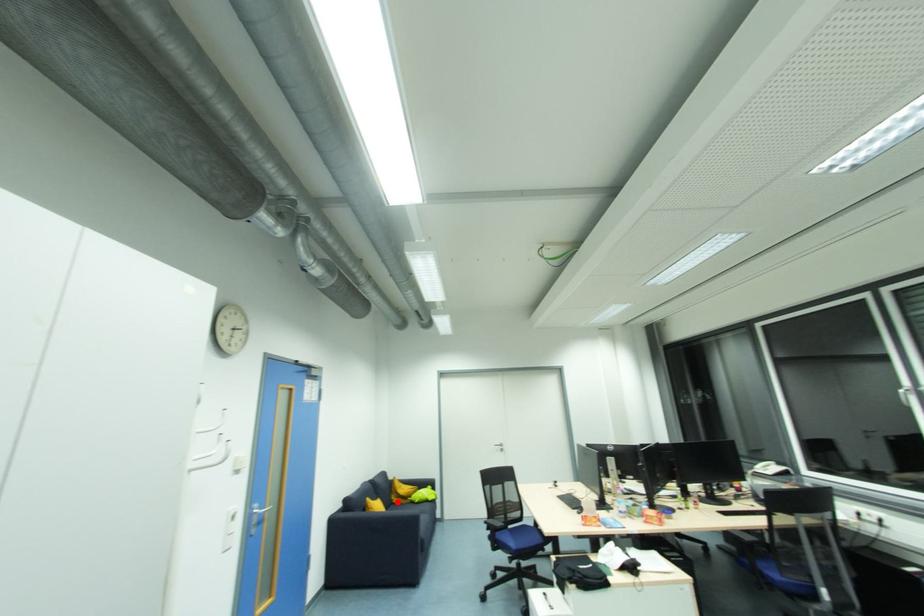
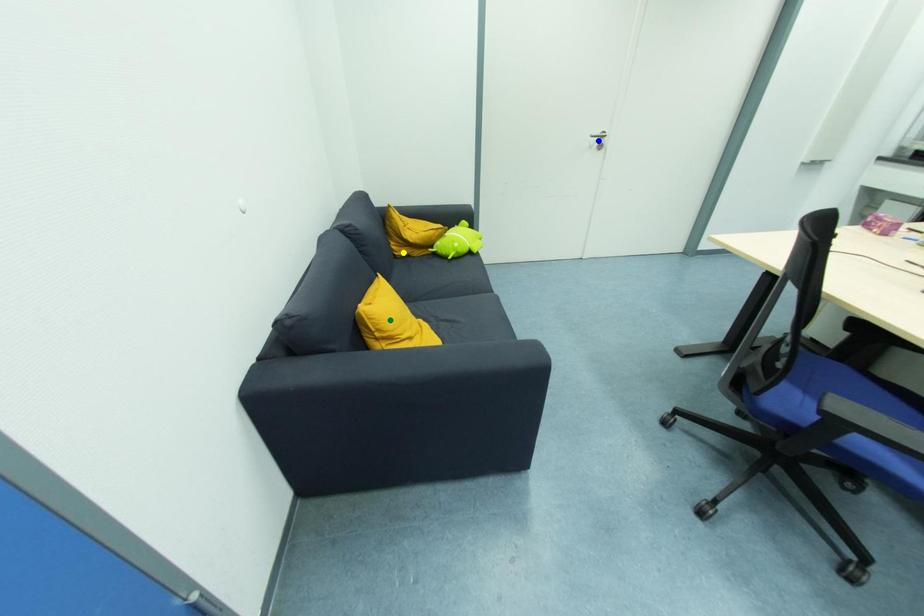
Question: I am providing you with two images of the same scene from different viewpoints. A red point is marked on the first image. You are given multiple points on the second image. Which mark in image 2 goes with the point in image 1?

Choices:
 (A) yellow point
 (B) green point
 (C) blue point

Answer: (A)